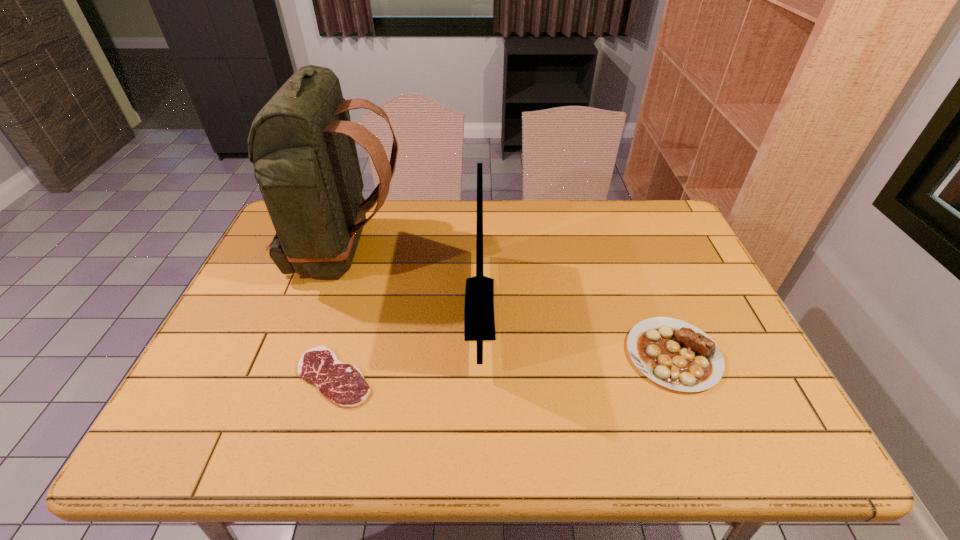
The width and height of the screenshot is (960, 540). Identify the location of the tallest object. (302, 142).

In order to click on the third shortest object in this screenshot , I will do `click(479, 323)`.

The width and height of the screenshot is (960, 540). Identify the location of monitor. (479, 323).

The image size is (960, 540). Identify the location of the third tallest object. (675, 354).

The height and width of the screenshot is (540, 960). Identify the location of the right steak. (675, 354).

Identify the location of the shortest object. The image size is (960, 540). (342, 383).

In order to click on the shorter steak in this screenshot , I will do `click(342, 383)`.

Identify the location of vacant space located 0.280m on the back of the backpack. This screenshot has width=960, height=540. (498, 252).

Where is `vacant point located 0.320m on the front-facing side of the third shortest object`? The width and height of the screenshot is (960, 540). vacant point located 0.320m on the front-facing side of the third shortest object is located at coordinates (612, 308).

Locate an element on the screen. Image resolution: width=960 pixels, height=540 pixels. vacant space situated 0.320m on the left of the rightmost object is located at coordinates (496, 355).